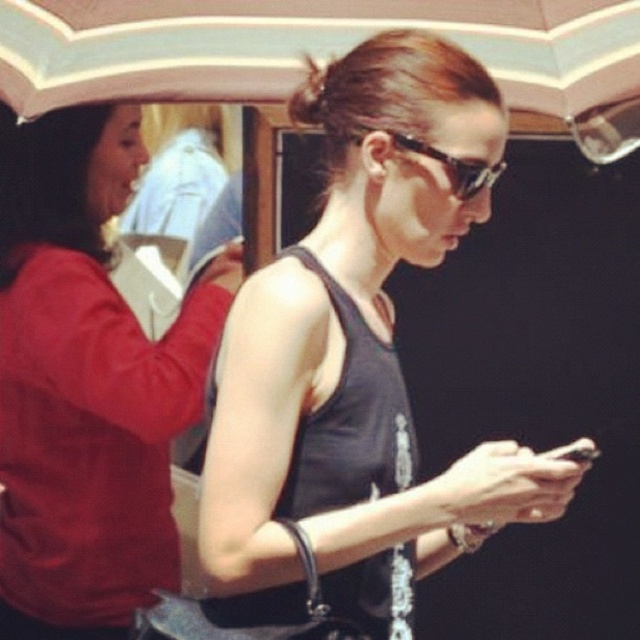
Does matte red sweater at left lie in front of black plastic sunglasses at center?

That is False.

Does matte red sweater at left have a greater width compared to black plastic sunglasses at center?

Correct, the width of matte red sweater at left exceeds that of black plastic sunglasses at center.

Does point (99, 492) come behind point (499, 176)?

No, (99, 492) is closer to viewer.

Identify the location of matte red sweater at left. Image resolution: width=640 pixels, height=640 pixels. (86, 384).

Between matte black tank top at center and matte red sweater at left, which one has less height?

matte black tank top at center is shorter.

Where is `matte black tank top at center`? matte black tank top at center is located at coordinates (355, 368).

Locate an element on the screen. The height and width of the screenshot is (640, 640). matte black tank top at center is located at coordinates click(355, 368).

Does matte black tank top at center have a smaller size compared to white striped fabric umbrella at upper center?

No.

Between point (563, 508) and point (147, 20), which one is positioned in front?

Point (563, 508) is more forward.

This screenshot has width=640, height=640. I want to click on matte black tank top at center, so click(x=355, y=368).